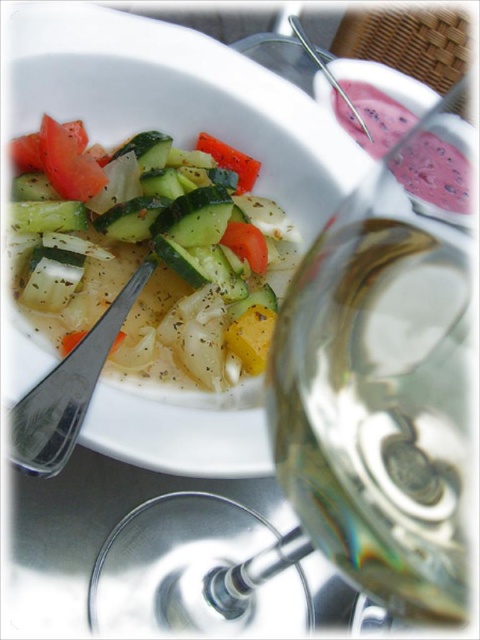
You are a food photographer trying to capture the pink smoothie at upper right in focus. You notice the clear glass wine glass at center is currently blocking your view. Can you move the wine glass to the side to get a clear shot of the smoothie?

The clear glass wine glass at center is in front of the pink smoothie at upper right, so moving it aside would allow you to focus on the smoothie.

You are a person with a 18 cm long hand. You want to pick up the clear glass wine glass at center from the table. Can your hand reach the glass?

The clear glass wine glass at center is 19.56 centimeters away from the viewer. Since your hand is 18 cm long, you cannot reach the glass as the distance is greater than your hand length.